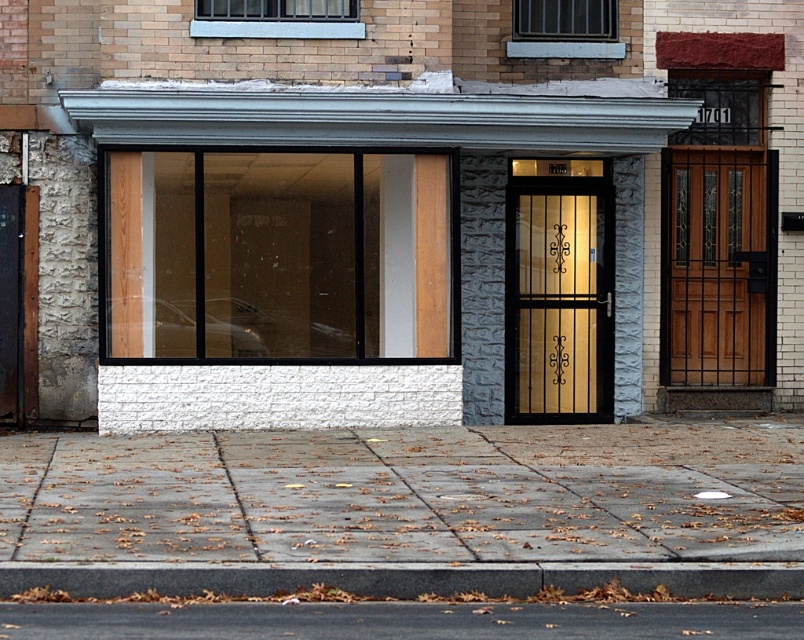
Is gray concrete pavement at lower center positioned behind gray concrete curb at lower center?

Yes, gray concrete pavement at lower center is further from the viewer.

Image resolution: width=804 pixels, height=640 pixels. Identify the location of gray concrete pavement at lower center. (405, 509).

Can you confirm if white brick wall at center is thinner than gray concrete curb at lower center?

Incorrect, white brick wall at center's width is not less than gray concrete curb at lower center's.

I want to click on white brick wall at center, so click(429, 147).

What are the coordinates of `white brick wall at center` in the screenshot? It's located at tap(429, 147).

Is point (314, 634) positioned in front of point (640, 572)?

Yes, point (314, 634) is in front of point (640, 572).

Which is more to the right, smooth asphalt road at lower center or gray concrete curb at lower center?

smooth asphalt road at lower center

Is point (790, 612) more distant than point (638, 589)?

No.

Identify the location of smooth asphalt road at lower center. (402, 620).